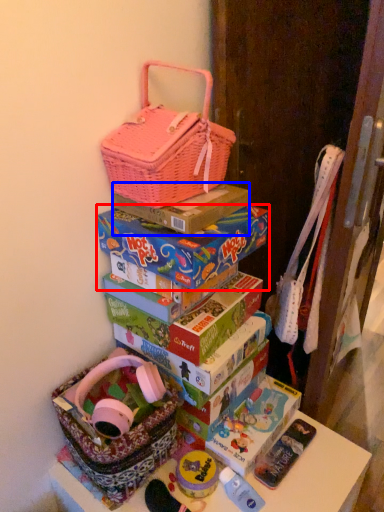
Question: Which of the following is the closest to the observer, box (highlighted by a red box) or box (highlighted by a blue box)?

Choices:
 (A) box
 (B) box

Answer: (A)